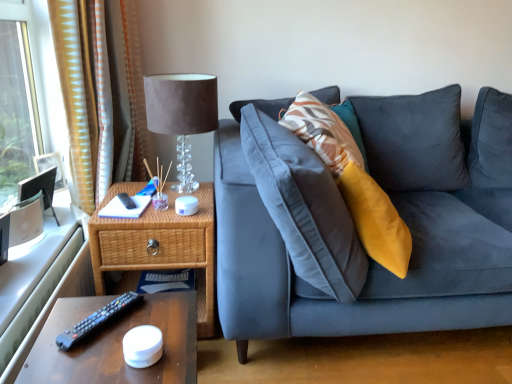
Question: Is point (69, 339) closer or farther from the camera than point (176, 195)?

Choices:
 (A) closer
 (B) farther

Answer: (A)

Question: Is black plastic remote at lower left bigger or smaller than woven wood nightstand at left?

Choices:
 (A) big
 (B) small

Answer: (B)

Question: Considering the real-world distances, which object is closest to the brown wooden table at lower left?

Choices:
 (A) yellow striped fabric at left
 (B) woven wood nightstand at left
 (C) suede-like fabric lampshade at upper left
 (D) black plastic remote at lower left

Answer: (D)

Question: Considering the real-world distances, which object is farthest from the black plastic remote at lower left?

Choices:
 (A) woven wood nightstand at left
 (B) brown wooden table at lower left
 (C) suede-like fabric lampshade at upper left
 (D) yellow striped fabric at left

Answer: (D)